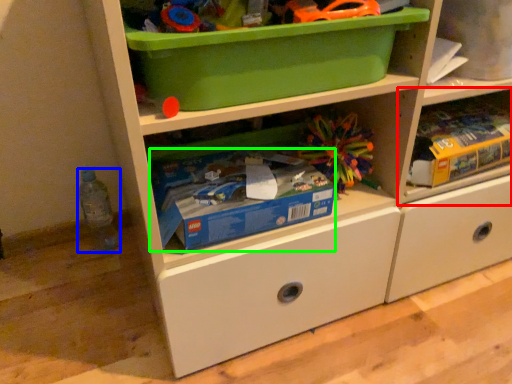
Question: Which object is the farthest from shelf (highlighted by a red box)? Choose among these: bottle (highlighted by a blue box) or storage box (highlighted by a green box).

Choices:
 (A) bottle
 (B) storage box

Answer: (A)